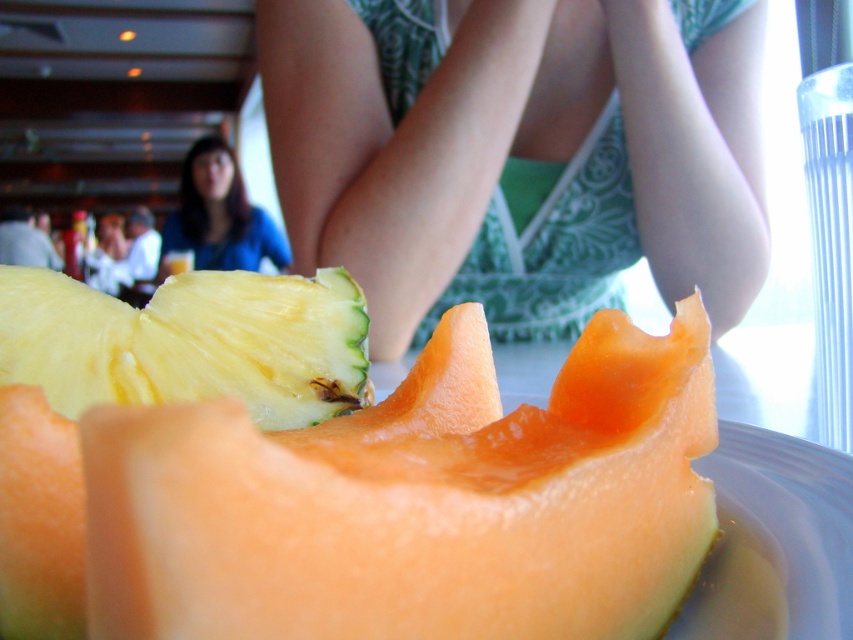
In the scene shown: Who is higher up, green printed fabric at center or blue fabric shirt at upper left?

green printed fabric at center is above.

Can you confirm if green printed fabric at center is positioned to the right of blue fabric shirt at upper left?

Yes, green printed fabric at center is to the right of blue fabric shirt at upper left.

Locate an element on the screen. This screenshot has width=853, height=640. green printed fabric at center is located at coordinates (514, 141).

Is the position of orange fleshed cantaloupe at center more distant than that of blue fabric shirt at upper left?

No, it is not.

Which is above, orange fleshed cantaloupe at center or blue fabric shirt at upper left?

blue fabric shirt at upper left

Who is more forward, (138,589) or (247,259)?

Point (138,589)

Where is `orange fleshed cantaloupe at center`? orange fleshed cantaloupe at center is located at coordinates (416, 502).

Is point (329, 380) farther from camera compared to point (230, 168)?

No, it is not.

Does yellow/green textured pineapple at center have a smaller size compared to blue fabric shirt at upper left?

Yes.

Where is `yellow/green textured pineapple at center`? The height and width of the screenshot is (640, 853). yellow/green textured pineapple at center is located at coordinates (189, 342).